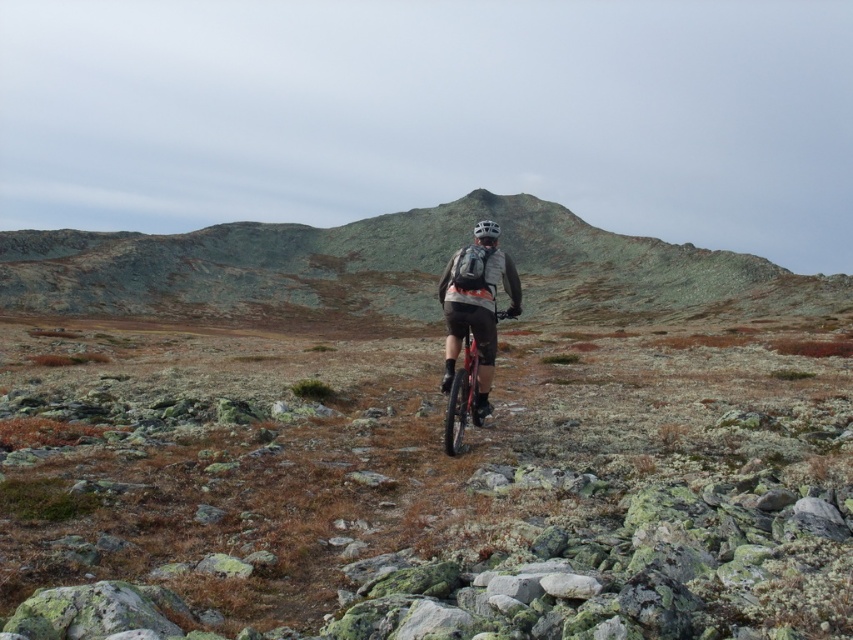
Question: Considering the real-world distances, which object is farthest from the shiny red bicycle at center?

Choices:
 (A) silver metallic helmet at center
 (B) green mossy rock at center
 (C) matte gray jacket at center
 (D) rough textured rocks at center

Answer: (B)

Question: Is rough textured rocks at center smaller than silver metallic helmet at center?

Choices:
 (A) no
 (B) yes

Answer: (A)

Question: Can you confirm if rough textured rocks at center is positioned to the right of silver metallic helmet at center?

Choices:
 (A) no
 (B) yes

Answer: (B)

Question: Among these points, which one is nearest to the camera?

Choices:
 (A) (73, 248)
 (B) (227, 336)
 (C) (486, 220)
 (D) (476, 362)

Answer: (D)

Question: Which point appears farthest from the camera in this image?

Choices:
 (A) (480, 227)
 (B) (421, 268)

Answer: (B)

Question: Does matte gray jacket at center appear on the left side of shiny red bicycle at center?

Choices:
 (A) no
 (B) yes

Answer: (A)